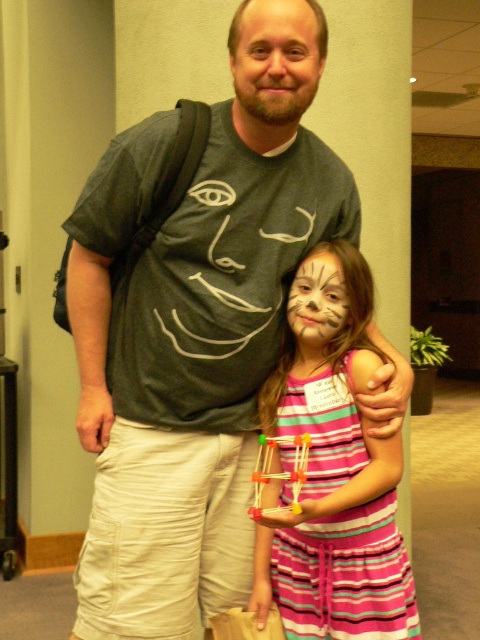
What object is located at the coordinates point (276,60) in the image?

The point (276,60) marks the matte gray face at center.